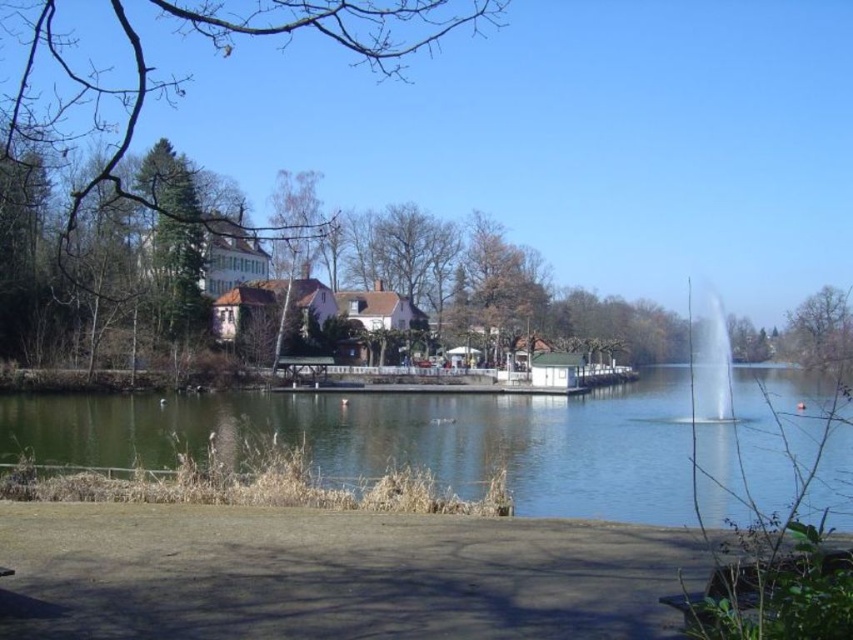
Question: Does wooden park bench at lower right appear under clear glass fountain at center?

Choices:
 (A) no
 (B) yes

Answer: (B)

Question: Is bare wood tree at center positioned at the back of clear glass fountain at center?

Choices:
 (A) yes
 (B) no

Answer: (A)

Question: Which point is closer to the camera?

Choices:
 (A) (729, 417)
 (B) (474, 440)

Answer: (B)

Question: Estimate the real-world distances between objects in this image. Which object is closer to the wooden park bench at lower right?

Choices:
 (A) bare wood tree at center
 (B) bare branches at upper right
 (C) green leafy tree at upper left
 (D) clear glass fountain at center

Answer: (D)

Question: Can you confirm if green water at center is smaller than wooden park bench at lower right?

Choices:
 (A) yes
 (B) no

Answer: (B)

Question: Estimate the real-world distances between objects in this image. Which object is farther from the green leafy tree at upper left?

Choices:
 (A) bare branches at upper right
 (B) green water at center

Answer: (A)